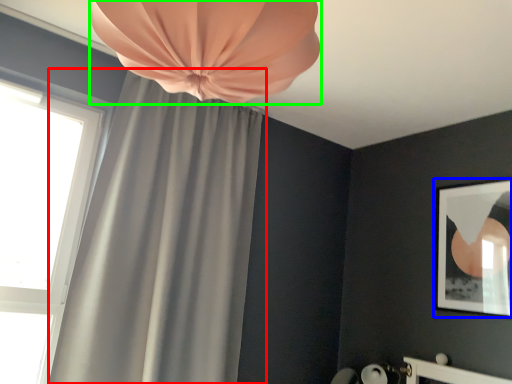
Question: Based on their relative distances, which object is nearer to curtain (highlighted by a red box)? Choose from picture frame (highlighted by a blue box) and curtain (highlighted by a green box).

Choices:
 (A) picture frame
 (B) curtain

Answer: (B)